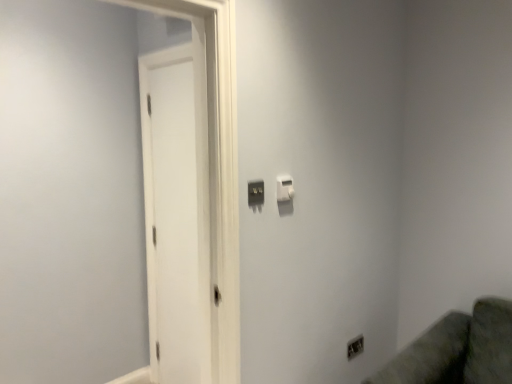
Question: From a real-world perspective, is white matte door at left located higher than satin silver outlet at lower right?

Choices:
 (A) yes
 (B) no

Answer: (A)

Question: Is white matte door at left smaller than satin silver outlet at lower right?

Choices:
 (A) no
 (B) yes

Answer: (A)

Question: Can you confirm if white matte door at left is shorter than satin silver outlet at lower right?

Choices:
 (A) no
 (B) yes

Answer: (A)

Question: Is white matte door at left closer to camera compared to satin silver outlet at lower right?

Choices:
 (A) yes
 (B) no

Answer: (A)

Question: Does white matte door at left appear on the left side of satin silver outlet at lower right?

Choices:
 (A) yes
 (B) no

Answer: (A)

Question: From the image's perspective, is satin silver outlet at lower right positioned above or below white plastic light switch at upper center, which appears as the 2th light switch when viewed from the left?

Choices:
 (A) below
 (B) above

Answer: (A)

Question: In terms of size, does satin silver outlet at lower right appear bigger or smaller than white plastic light switch at upper center, the 2th light switch when ordered from front to back?

Choices:
 (A) big
 (B) small

Answer: (A)

Question: From a real-world perspective, is satin silver outlet at lower right above or below white plastic light switch at upper center, which is the first light switch in back-to-front order?

Choices:
 (A) below
 (B) above

Answer: (A)

Question: Considering the positions of satin silver outlet at lower right and white plastic light switch at upper center, the 2th light switch when ordered from front to back, in the image, is satin silver outlet at lower right wider or thinner than white plastic light switch at upper center, the 2th light switch when ordered from front to back,?

Choices:
 (A) thin
 (B) wide

Answer: (A)

Question: Is matte black switch at center, which ranks as the second light switch in back-to-front order, bigger or smaller than white plastic light switch at upper center, acting as the first light switch starting from the right?

Choices:
 (A) small
 (B) big

Answer: (A)

Question: Is matte black switch at center, which ranks as the second light switch in back-to-front order, wider or thinner than white plastic light switch at upper center, which is the first light switch in back-to-front order?

Choices:
 (A) thin
 (B) wide

Answer: (A)

Question: Is matte black switch at center, which ranks as the second light switch in back-to-front order, spatially inside white plastic light switch at upper center, acting as the first light switch starting from the right, or outside of it?

Choices:
 (A) outside
 (B) inside

Answer: (A)

Question: From a real-world perspective, relative to white plastic light switch at upper center, the 2th light switch when ordered from front to back, is matte black switch at center, which is the first light switch in front-to-back order, vertically above or below?

Choices:
 (A) below
 (B) above

Answer: (A)

Question: Considering the positions of white matte door at left and satin silver outlet at lower right in the image, is white matte door at left taller or shorter than satin silver outlet at lower right?

Choices:
 (A) tall
 (B) short

Answer: (A)

Question: Is white matte door at left spatially inside satin silver outlet at lower right, or outside of it?

Choices:
 (A) inside
 (B) outside

Answer: (B)